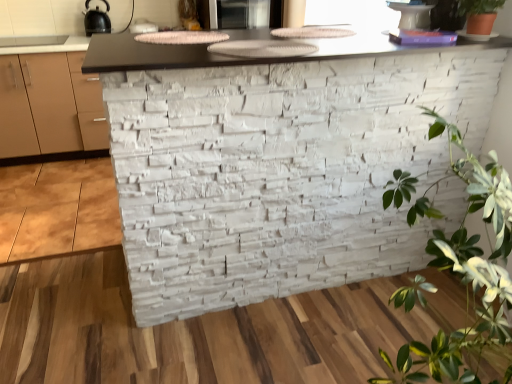
The width and height of the screenshot is (512, 384). In order to click on white stone wall at center in this screenshot , I will do `click(283, 173)`.

How much space does matte black microwave at upper center, the 2th appliance when ordered from left to right, occupy horizontally?

matte black microwave at upper center, the 2th appliance when ordered from left to right, is 24.79 inches in width.

In order to face matte black microwave at upper center, the 1th appliance positioned from the right, should I rotate leftwards or rightwards?

Rotate your view left by about 1.627°.

Where is `green matte plant at upper right, marked as the first houseplant in a top-to-bottom arrangement`? The image size is (512, 384). green matte plant at upper right, marked as the first houseplant in a top-to-bottom arrangement is located at coordinates (479, 14).

What do you see at coordinates (464, 268) in the screenshot? The width and height of the screenshot is (512, 384). I see `green leafy plant at right, which ranks as the second houseplant in top-to-bottom order` at bounding box center [464, 268].

At what (x,y) coordinates should I click in order to perform the action: click on white stone wall at center. Please return your answer as a coordinate pair (x, y). Looking at the image, I should click on (283, 173).

Is point (272, 3) behind point (490, 19)?

Yes, it is.

Considering the relative positions of matte black microwave at upper center, the 1th appliance positioned from the right, and green matte plant at upper right, marked as the first houseplant in a top-to-bottom arrangement, in the image provided, is matte black microwave at upper center, the 1th appliance positioned from the right, in front of green matte plant at upper right, marked as the first houseplant in a top-to-bottom arrangement,?

No, it is not.

Are matte black microwave at upper center, the 2th appliance when ordered from left to right, and green matte plant at upper right, positioned as the second houseplant in bottom-to-top order, making contact?

matte black microwave at upper center, the 2th appliance when ordered from left to right, and green matte plant at upper right, positioned as the second houseplant in bottom-to-top order, are clearly separated.

Does green leafy plant at right, which ranks as the second houseplant in top-to-bottom order, have a smaller size compared to matte black microwave at upper center, the 1th appliance positioned from the right?

Incorrect, green leafy plant at right, which ranks as the second houseplant in top-to-bottom order, is not smaller in size than matte black microwave at upper center, the 1th appliance positioned from the right.

In the scene shown: Considering the sizes of objects green leafy plant at right, which is counted as the 1th houseplant, starting from the bottom, and matte black microwave at upper center, the 2th appliance when ordered from left to right, in the image provided, who is wider, green leafy plant at right, which is counted as the 1th houseplant, starting from the bottom, or matte black microwave at upper center, the 2th appliance when ordered from left to right,?

Wider between the two is green leafy plant at right, which is counted as the 1th houseplant, starting from the bottom.

From the image's perspective, count 2nd appliances upward from the green leafy plant at right, which ranks as the second houseplant in top-to-bottom order, and point to it. Please provide its 2D coordinates.

[(246, 14)]

How many degrees apart are the facing directions of green leafy plant at right, which is counted as the 1th houseplant, starting from the bottom, and matte black microwave at upper center, the 2th appliance when ordered from left to right?

They differ by 90.2 degrees in their facing directions.

Based on the photo, from the image's perspective, is green leafy plant at right, which is counted as the 1th houseplant, starting from the bottom, above black matte kettle at upper left, the second appliance from the right?

No, from the image's perspective, green leafy plant at right, which is counted as the 1th houseplant, starting from the bottom, is not on top of black matte kettle at upper left, the second appliance from the right.

Looking at the image, does green leafy plant at right, which ranks as the second houseplant in top-to-bottom order, seem bigger or smaller compared to black matte kettle at upper left, the second appliance from the right?

In the image, green leafy plant at right, which ranks as the second houseplant in top-to-bottom order, appears to be larger than black matte kettle at upper left, the second appliance from the right.

In the scene shown: Is green leafy plant at right, which is counted as the 1th houseplant, starting from the bottom, aimed at black matte kettle at upper left, the 1th appliance viewed from the left?

No, green leafy plant at right, which is counted as the 1th houseplant, starting from the bottom, is not oriented towards black matte kettle at upper left, the 1th appliance viewed from the left.

Is matte black microwave at upper center, the 1th appliance positioned from the right, closer to the viewer compared to green leafy plant at right, which ranks as the second houseplant in top-to-bottom order?

No.

In the scene shown: Which is correct: matte black microwave at upper center, the 1th appliance positioned from the right, is inside green leafy plant at right, which ranks as the second houseplant in top-to-bottom order, or outside of it?

matte black microwave at upper center, the 1th appliance positioned from the right, exists outside the volume of green leafy plant at right, which ranks as the second houseplant in top-to-bottom order.

Is matte black microwave at upper center, the 1th appliance positioned from the right, oriented towards green leafy plant at right, which is counted as the 1th houseplant, starting from the bottom?

Yes.

Which is less distant, (272, 12) or (408, 184)?

The point (408, 184) is closer to the camera.

Does point (105, 20) appear closer or farther from the camera than point (493, 320)?

Point (105, 20) is positioned farther from the camera compared to point (493, 320).

In the scene shown: Does black matte kettle at upper left, the 1th appliance viewed from the left, appear on the right side of green leafy plant at right, which is counted as the 1th houseplant, starting from the bottom?

In fact, black matte kettle at upper left, the 1th appliance viewed from the left, is to the left of green leafy plant at right, which is counted as the 1th houseplant, starting from the bottom.

This screenshot has height=384, width=512. In order to click on the 2nd appliance counting from the left of the green leafy plant at right, which is counted as the 1th houseplant, starting from the bottom in this screenshot , I will do `click(96, 19)`.

Is black matte kettle at upper left, the 1th appliance viewed from the left, looking in the opposite direction of green leafy plant at right, which is counted as the 1th houseplant, starting from the bottom?

No, green leafy plant at right, which is counted as the 1th houseplant, starting from the bottom, is not at the back of black matte kettle at upper left, the 1th appliance viewed from the left.

From the picture: Are white stone wall at center and green matte plant at upper right, marked as the first houseplant in a top-to-bottom arrangement, far apart?

No.

Is white stone wall at center closer to the viewer compared to green matte plant at upper right, positioned as the second houseplant in bottom-to-top order?

Yes, the depth of white stone wall at center is less than that of green matte plant at upper right, positioned as the second houseplant in bottom-to-top order.

Considering the relative sizes of white stone wall at center and green matte plant at upper right, positioned as the second houseplant in bottom-to-top order, in the image provided, is white stone wall at center shorter than green matte plant at upper right, positioned as the second houseplant in bottom-to-top order,?

No, white stone wall at center is not shorter than green matte plant at upper right, positioned as the second houseplant in bottom-to-top order.

Does point (177, 253) come farther from viewer compared to point (475, 9)?

Yes.

Looking at their sizes, would you say green leafy plant at right, which ranks as the second houseplant in top-to-bottom order, is wider or thinner than white stone wall at center?

green leafy plant at right, which ranks as the second houseplant in top-to-bottom order, is thinner than white stone wall at center.

Image resolution: width=512 pixels, height=384 pixels. In order to click on brickwork above the green leafy plant at right, which is counted as the 1th houseplant, starting from the bottom (from the image's perspective) in this screenshot , I will do point(283,173).

Between point (458, 255) and point (162, 129), which one is positioned in front?

The point (458, 255) is closer to the camera.

Measure the distance between green leafy plant at right, which ranks as the second houseplant in top-to-bottom order, and white stone wall at center.

green leafy plant at right, which ranks as the second houseplant in top-to-bottom order, is 18.44 inches from white stone wall at center.

What are the coordinates of `the 1st appliance to the left when counting from the green matte plant at upper right, marked as the first houseplant in a top-to-bottom arrangement` in the screenshot? It's located at (246, 14).

The image size is (512, 384). Find the location of `houseplant below the matte black microwave at upper center, the 2th appliance when ordered from left to right (from a real-world perspective)`. houseplant below the matte black microwave at upper center, the 2th appliance when ordered from left to right (from a real-world perspective) is located at coordinates (464, 268).

Consider the image. From the image, which object appears to be nearer to white stone wall at center, matte black microwave at upper center, the 1th appliance positioned from the right, or green leafy plant at right, which is counted as the 1th houseplant, starting from the bottom?

green leafy plant at right, which is counted as the 1th houseplant, starting from the bottom, is closer to white stone wall at center.

From the image, which object appears to be farther from green leafy plant at right, which is counted as the 1th houseplant, starting from the bottom, white stone wall at center or green matte plant at upper right, marked as the first houseplant in a top-to-bottom arrangement?

Among the two, green matte plant at upper right, marked as the first houseplant in a top-to-bottom arrangement, is located further to green leafy plant at right, which is counted as the 1th houseplant, starting from the bottom.

When comparing their distances from matte black microwave at upper center, the 2th appliance when ordered from left to right, does green leafy plant at right, which is counted as the 1th houseplant, starting from the bottom, or white stone wall at center seem closer?

white stone wall at center is closer to matte black microwave at upper center, the 2th appliance when ordered from left to right.

When comparing their distances from matte black microwave at upper center, the 1th appliance positioned from the right, does green leafy plant at right, which ranks as the second houseplant in top-to-bottom order, or black matte kettle at upper left, the second appliance from the right, seem closer?

Based on the image, green leafy plant at right, which ranks as the second houseplant in top-to-bottom order, appears to be nearer to matte black microwave at upper center, the 1th appliance positioned from the right.

Which object lies nearer to the anchor point green matte plant at upper right, marked as the first houseplant in a top-to-bottom arrangement, black matte kettle at upper left, the 1th appliance viewed from the left, or white stone wall at center?

white stone wall at center is closer to green matte plant at upper right, marked as the first houseplant in a top-to-bottom arrangement.

Which object lies further to the anchor point green matte plant at upper right, positioned as the second houseplant in bottom-to-top order, white stone wall at center or green leafy plant at right, which ranks as the second houseplant in top-to-bottom order?

white stone wall at center lies further to green matte plant at upper right, positioned as the second houseplant in bottom-to-top order, than the other object.

Based on their spatial positions, is black matte kettle at upper left, the second appliance from the right, or green leafy plant at right, which is counted as the 1th houseplant, starting from the bottom, further from white stone wall at center?

black matte kettle at upper left, the second appliance from the right, is positioned further to the anchor white stone wall at center.

Based on their spatial positions, is green matte plant at upper right, marked as the first houseplant in a top-to-bottom arrangement, or green leafy plant at right, which is counted as the 1th houseplant, starting from the bottom, closer to matte black microwave at upper center, the 1th appliance positioned from the right?

green matte plant at upper right, marked as the first houseplant in a top-to-bottom arrangement, lies closer to matte black microwave at upper center, the 1th appliance positioned from the right, than the other object.

Find the location of a particular element. houseplant between green leafy plant at right, which ranks as the second houseplant in top-to-bottom order, and black matte kettle at upper left, the second appliance from the right, in the front-back direction is located at coordinates (479, 14).

This screenshot has height=384, width=512. I want to click on houseplant positioned between white stone wall at center and black matte kettle at upper left, the 1th appliance viewed from the left, from near to far, so click(479, 14).

Locate an element on the screen. This screenshot has height=384, width=512. houseplant between green leafy plant at right, which is counted as the 1th houseplant, starting from the bottom, and matte black microwave at upper center, the 1th appliance positioned from the right, in the front-back direction is located at coordinates (479, 14).

Locate an element on the screen. The width and height of the screenshot is (512, 384). brickwork located between green leafy plant at right, which ranks as the second houseplant in top-to-bottom order, and black matte kettle at upper left, the 1th appliance viewed from the left, in the depth direction is located at coordinates (283, 173).